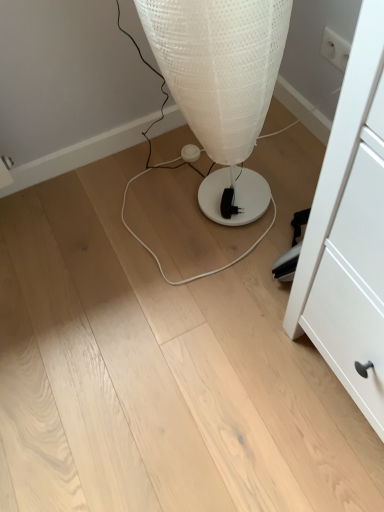
The height and width of the screenshot is (512, 384). I want to click on vacant area in front of white matte lamp at center, so click(x=200, y=280).